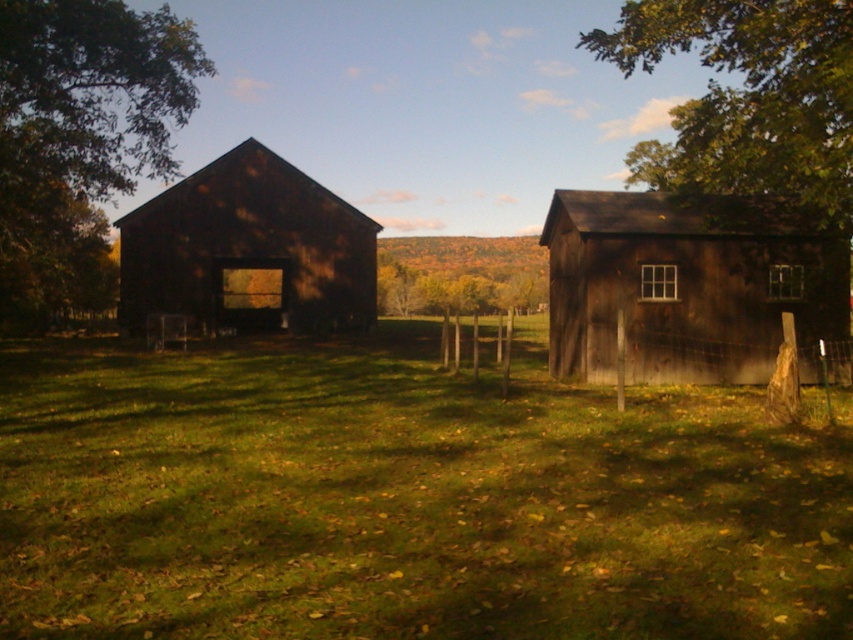
Between green grass at center and green leafy tree at left, which one appears on the right side from the viewer's perspective?

green grass at center is more to the right.

Between point (253, 614) and point (111, 52), which one is positioned in front?

Point (253, 614) is in front.

The height and width of the screenshot is (640, 853). What do you see at coordinates (404, 497) in the screenshot?
I see `green grass at center` at bounding box center [404, 497].

This screenshot has height=640, width=853. I want to click on green grass at center, so click(x=404, y=497).

Is green leafy tree at left taller than green leafy tree at upper right?

Incorrect, green leafy tree at left's height is not larger of green leafy tree at upper right's.

This screenshot has height=640, width=853. I want to click on green leafy tree at left, so click(x=80, y=140).

Is green grass at center wider than yellow autumn leaves at center?

Incorrect, green grass at center's width does not surpass yellow autumn leaves at center's.

Which is above, green grass at center or yellow autumn leaves at center?

Positioned higher is yellow autumn leaves at center.

I want to click on green grass at center, so click(404, 497).

The height and width of the screenshot is (640, 853). What are the coordinates of `green grass at center` in the screenshot? It's located at (404, 497).